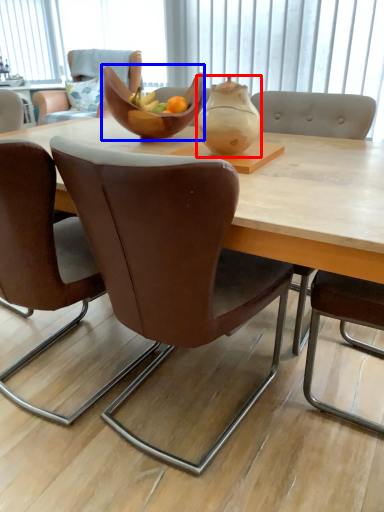
Question: Which point is closer to the camera, tea pot (highlighted by a red box) or bowl (highlighted by a blue box)?

Choices:
 (A) tea pot
 (B) bowl

Answer: (A)